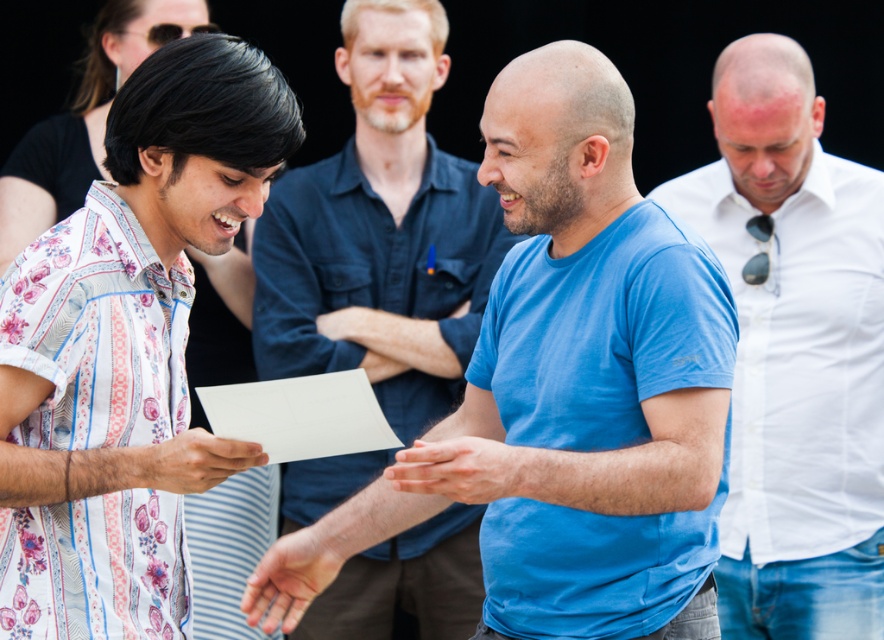
You are organizing a clothing display and need to arrange the white cotton shirt at right and the blue cotton shirt at center based on their sizes. Which shirt should you place in a smaller display space?

The white cotton shirt at right occupies less space than the blue cotton shirt at center, so it should be placed in the smaller display space.